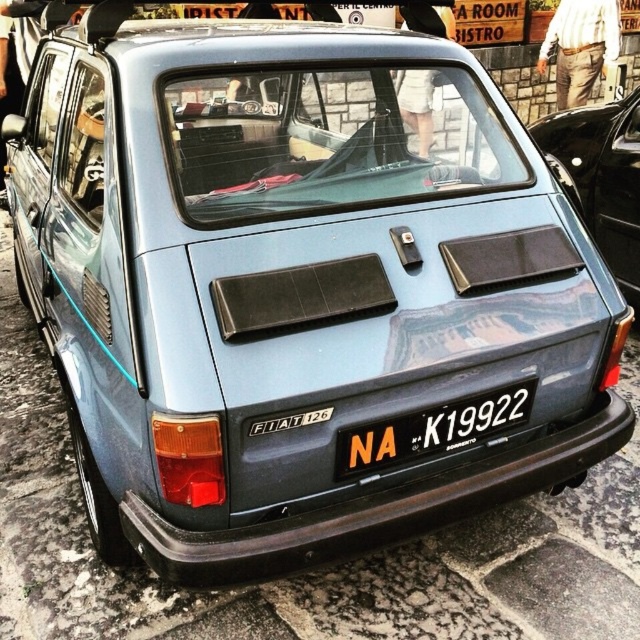
Question: Is the position of metallic blue car at center less distant than that of white plastic license plate at center?

Choices:
 (A) yes
 (B) no

Answer: (B)

Question: Does metallic blue car at center appear under white plastic license plate at center?

Choices:
 (A) no
 (B) yes

Answer: (A)

Question: Which object appears farthest from the camera in this image?

Choices:
 (A) white plastic license plate at center
 (B) metallic blue car at center

Answer: (B)

Question: Does metallic blue car at center appear on the right side of white plastic license plate at center?

Choices:
 (A) yes
 (B) no

Answer: (A)

Question: Which point is closer to the camera taking this photo?

Choices:
 (A) (337, 465)
 (B) (634, 291)

Answer: (A)